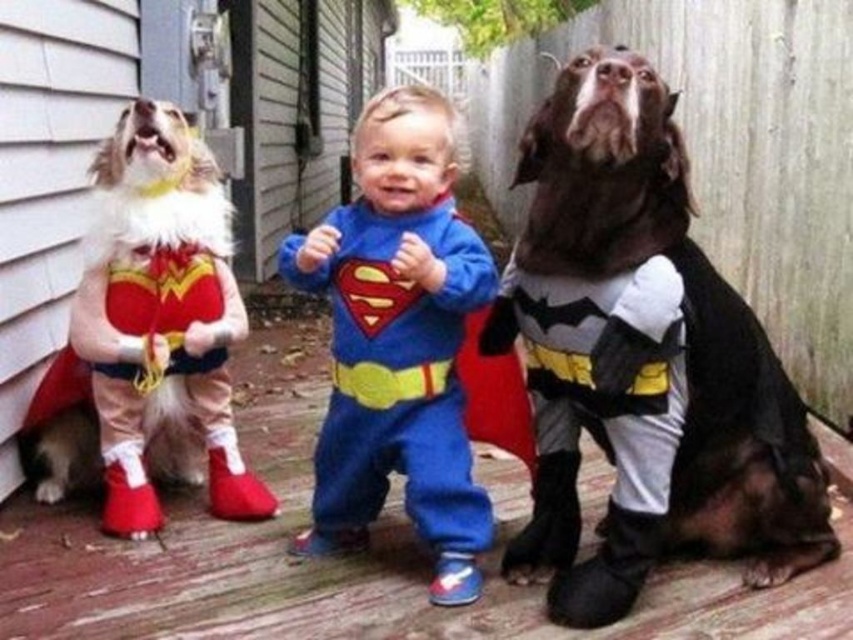
Question: Is dark brown fur batman at center to the right of blue fleece onesie at center from the viewer's perspective?

Choices:
 (A) no
 (B) yes

Answer: (B)

Question: Is dark brown fur batman at center to the left of blue fleece onesie at center from the viewer's perspective?

Choices:
 (A) yes
 (B) no

Answer: (B)

Question: Which of the following is the closest to the observer?

Choices:
 (A) (816, 522)
 (B) (234, 456)

Answer: (A)

Question: Which point is farther to the camera?

Choices:
 (A) (317, 438)
 (B) (157, 403)

Answer: (A)

Question: Does dark brown fur batman at center lie behind blue fleece onesie at center?

Choices:
 (A) yes
 (B) no

Answer: (B)

Question: Which of the following is the farthest from the observer?

Choices:
 (A) (111, 157)
 (B) (592, 84)
 (C) (364, 509)

Answer: (A)